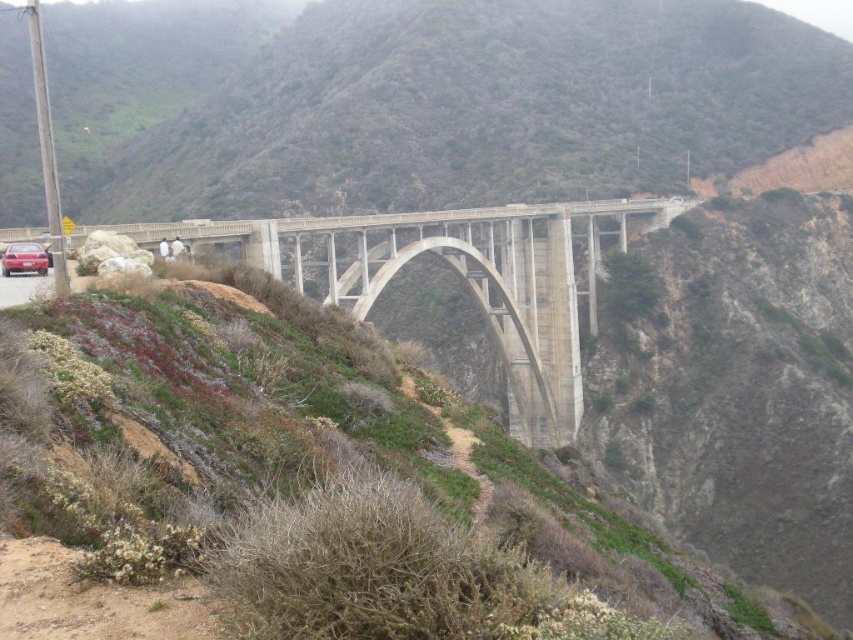
You are a photographer planning to capture a wide shot of the scenic Bixby Creek Bridge. You notice a matte red car parked at lower left. Considering the size difference between the concrete bridge at center and the matte red car at lower left, which object should you focus on to highlight the grandeur of the bridge in your composition?

The concrete bridge at center is larger in size than the matte red car at lower left, so focusing on the concrete bridge at center will better emphasize its grandeur in the composition.